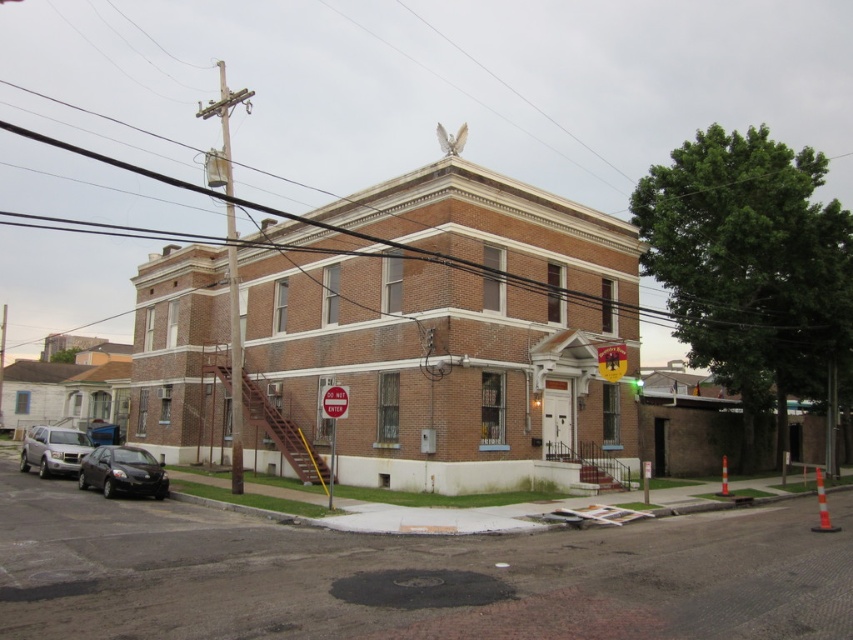
Question: Does matte black car at lower left appear on the right side of green glass traffic light at upper center?

Choices:
 (A) yes
 (B) no

Answer: (B)

Question: Which point is farther to the camera?

Choices:
 (A) matte black car at lower left
 (B) green glass traffic light at upper center
 (C) satin silver suv at lower left

Answer: (B)

Question: Which of these objects is positioned closest to the satin silver suv at lower left?

Choices:
 (A) green glass traffic light at upper center
 (B) matte black car at lower left

Answer: (B)

Question: Is satin silver suv at lower left smaller than green glass traffic light at upper center?

Choices:
 (A) yes
 (B) no

Answer: (B)

Question: Is satin silver suv at lower left wider than green glass traffic light at upper center?

Choices:
 (A) yes
 (B) no

Answer: (A)

Question: Among these points, which one is farthest from the camera?

Choices:
 (A) (20, 468)
 (B) (640, 396)

Answer: (A)